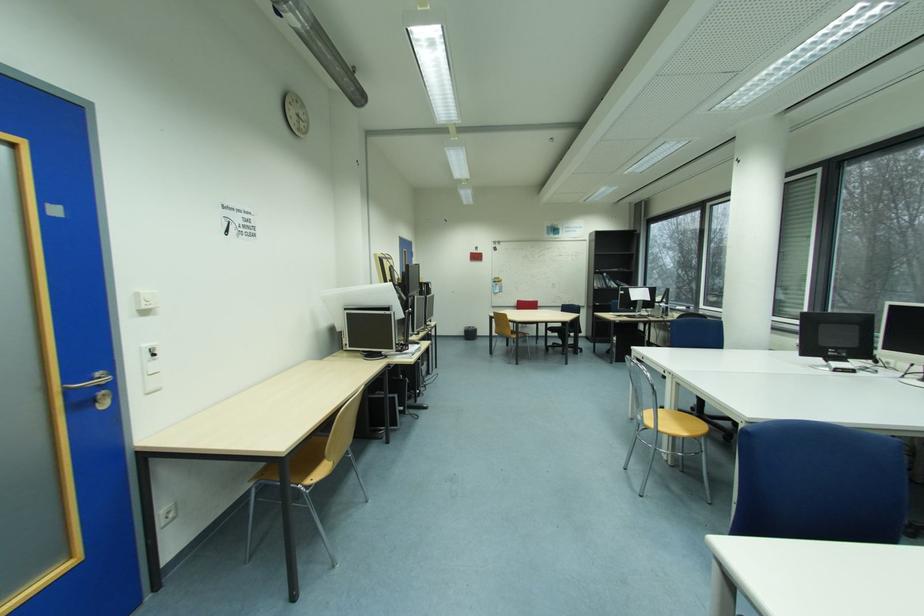
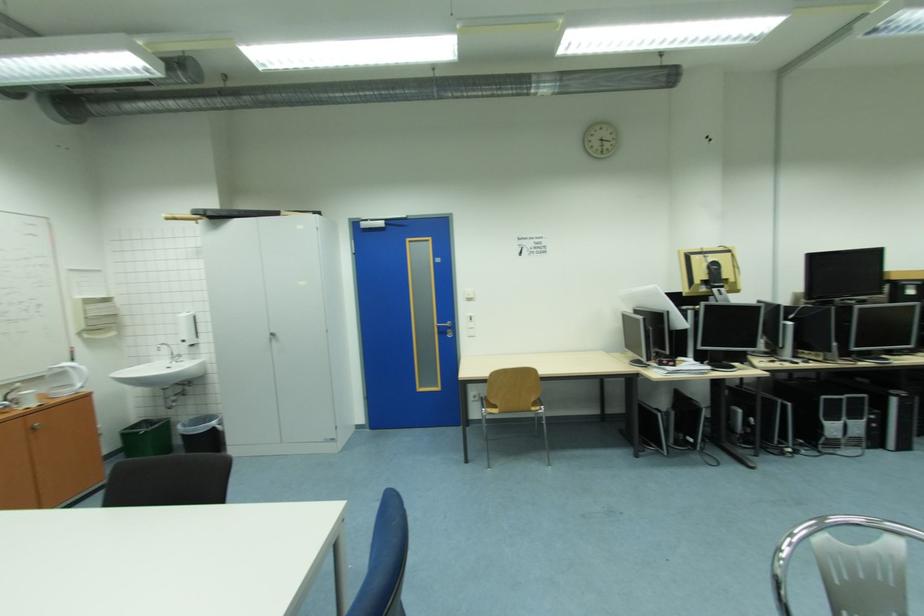
Find the pixel in the second image that matches (x=76, y=392) in the first image.

(445, 328)